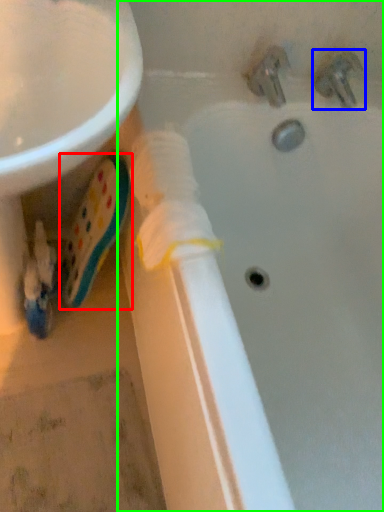
Question: Estimate the real-world distances between objects in this image. Which object is closer to toothpaste (highlighted by a red box), tap (highlighted by a blue box) or bathtub (highlighted by a green box)?

Choices:
 (A) tap
 (B) bathtub

Answer: (B)